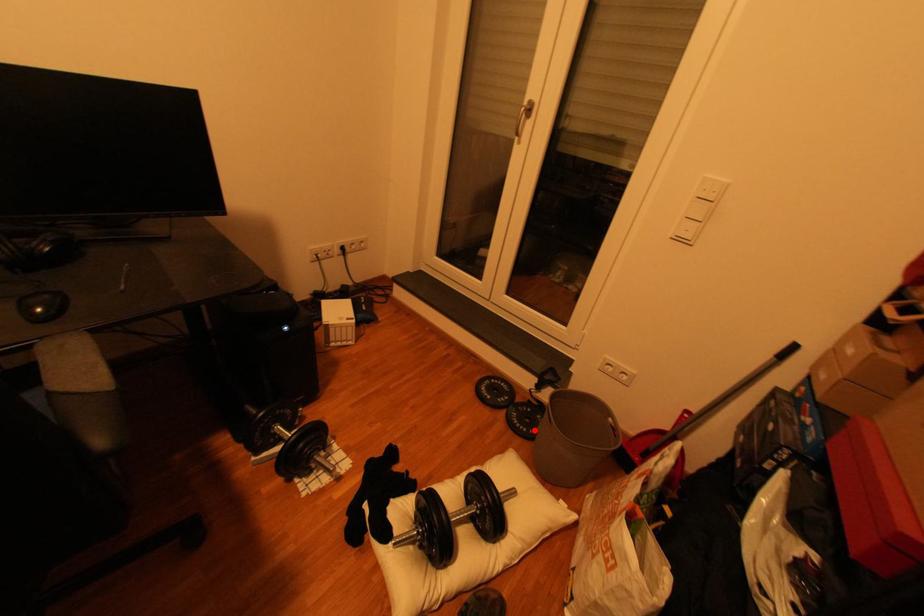
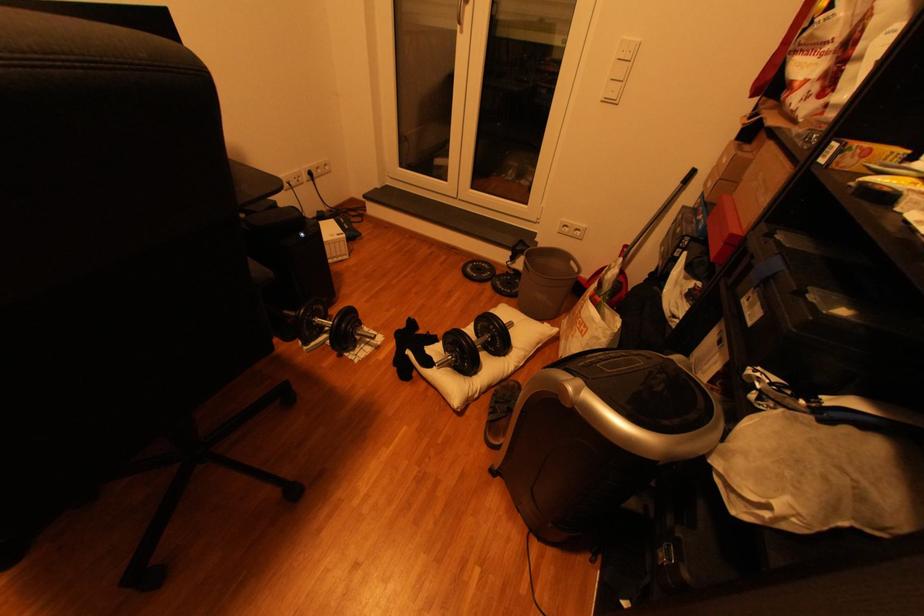
The point at the highlighted location is marked in the first image. Where is the corresponding point in the second image?

(518, 292)